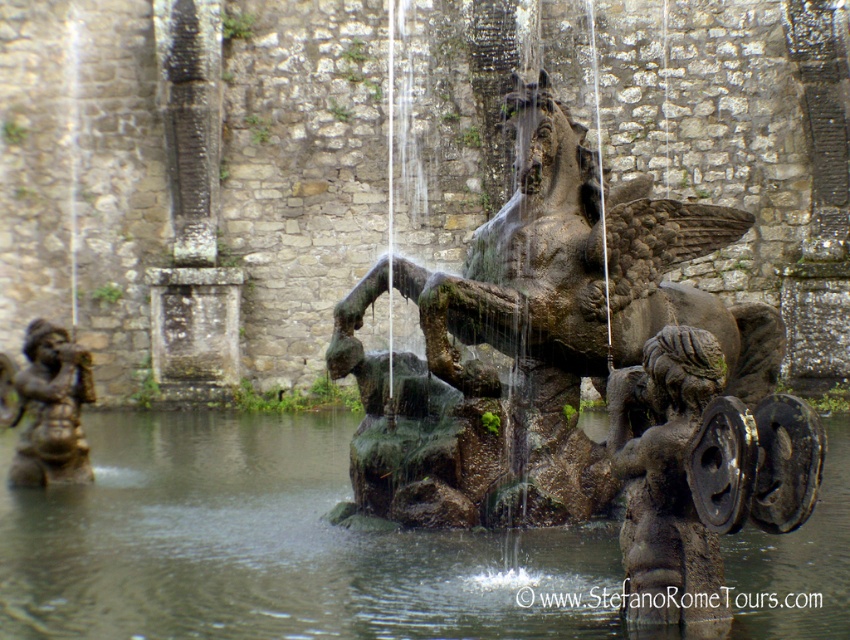
Question: In this image, where is greenish stone horse at center located relative to green mossy water at center?

Choices:
 (A) below
 (B) above

Answer: (B)

Question: Among these points, which one is farthest from the camera?

Choices:
 (A) (724, 564)
 (B) (625, 557)

Answer: (A)

Question: Is greenish stone horse at center smaller than bronze statue at left?

Choices:
 (A) no
 (B) yes

Answer: (A)

Question: Which is nearer to the green mossy water at center?

Choices:
 (A) greenish stone horse at center
 (B) bronze statue at left

Answer: (A)

Question: Which point appears farthest from the camera in this image?

Choices:
 (A) (51, 392)
 (B) (258, 452)

Answer: (B)

Question: Is greenish stone horse at center below green mossy water at center?

Choices:
 (A) yes
 (B) no

Answer: (B)